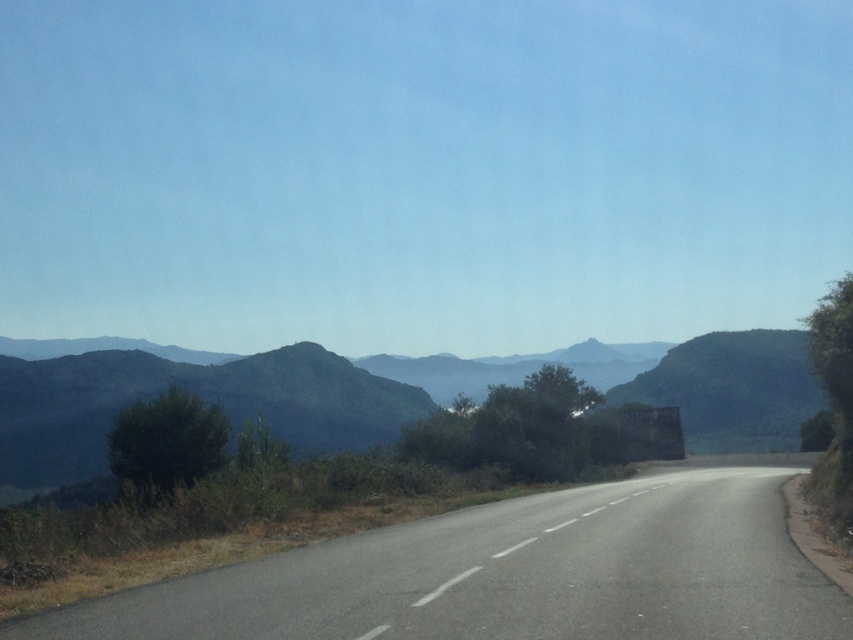
Question: Is asphalt road at center wider than green textured mountain at center?

Choices:
 (A) no
 (B) yes

Answer: (A)

Question: Which of the following is the closest to the observer?

Choices:
 (A) green textured mountain at center
 (B) asphalt road at center

Answer: (B)

Question: Which point appears closest to the camera in this image?

Choices:
 (A) [x=693, y=401]
 (B) [x=753, y=586]

Answer: (B)

Question: Where is asphalt road at center located in relation to green textured mountain at center in the image?

Choices:
 (A) below
 (B) above

Answer: (B)

Question: Which object appears farthest from the camera in this image?

Choices:
 (A) green textured mountain at center
 (B) asphalt road at center

Answer: (A)

Question: Is asphalt road at center wider than green textured mountain at center?

Choices:
 (A) no
 (B) yes

Answer: (A)